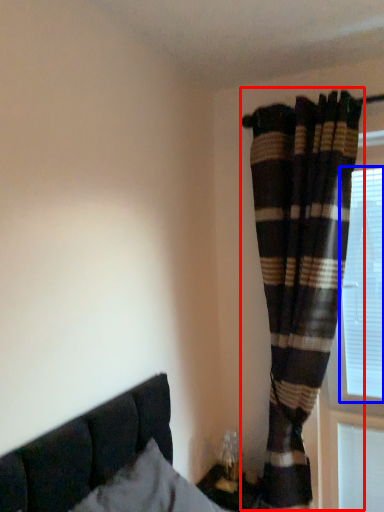
Question: Among these objects, which one is farthest to the camera, curtain (highlighted by a red box) or bay window (highlighted by a blue box)?

Choices:
 (A) curtain
 (B) bay window

Answer: (B)